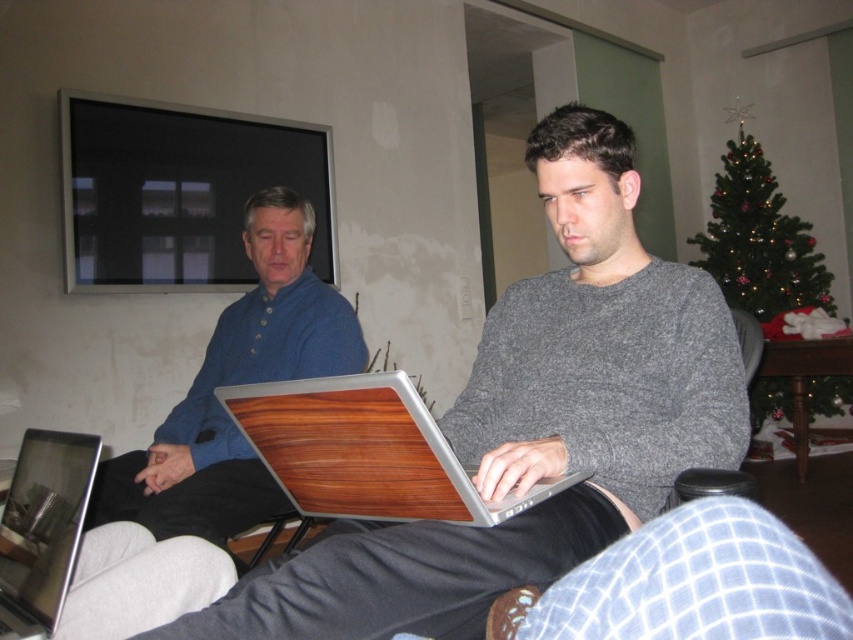
Question: Which object appears closest to the camera in this image?

Choices:
 (A) matte wood laptop at center
 (B) green matte christmas tree at upper right
 (C) wooden laptop at lower left

Answer: (A)

Question: Can you confirm if white checkered fabric at lower right is positioned below wooden-textured laptop at center?

Choices:
 (A) no
 (B) yes

Answer: (B)

Question: Is matte wood laptop at center smaller than green matte christmas tree at upper right?

Choices:
 (A) no
 (B) yes

Answer: (B)

Question: From the image, what is the correct spatial relationship of wooden-textured laptop at center in relation to black leather armchair at lower right?

Choices:
 (A) above
 (B) below

Answer: (B)

Question: Which object appears closest to the camera in this image?

Choices:
 (A) white checkered fabric at lower right
 (B) wooden laptop at lower left
 (C) matte wood laptop at center

Answer: (A)

Question: Considering the real-world distances, which object is farthest from the white checkered fabric at lower right?

Choices:
 (A) matte wood laptop at center
 (B) wooden-textured laptop at center

Answer: (A)